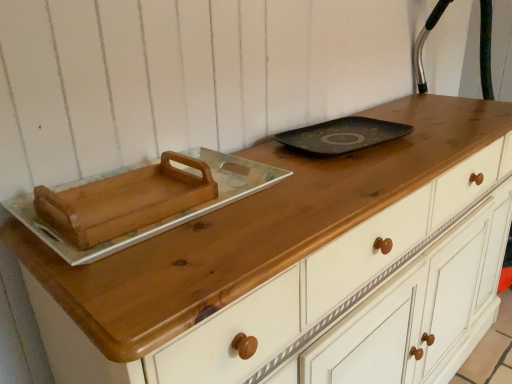
You are a GUI agent. You are given a task and a screenshot of the screen. Output one action in this format:
    pyautogui.click(x=<x>, y=<y>)
    Task: Click on the vacant area that is in front of black matte tray at center
    The image size is (512, 384).
    Given the screenshot: What is the action you would take?
    pyautogui.click(x=358, y=175)